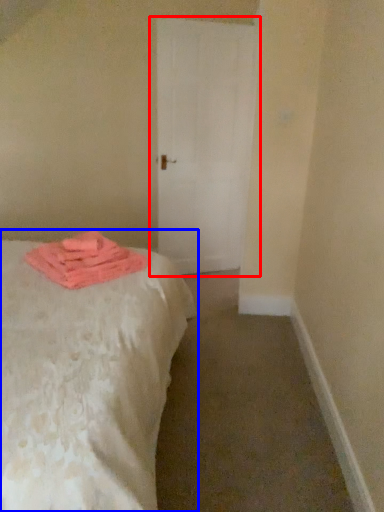
Question: Which point is closer to the camera, door (highlighted by a red box) or bed (highlighted by a blue box)?

Choices:
 (A) door
 (B) bed

Answer: (B)